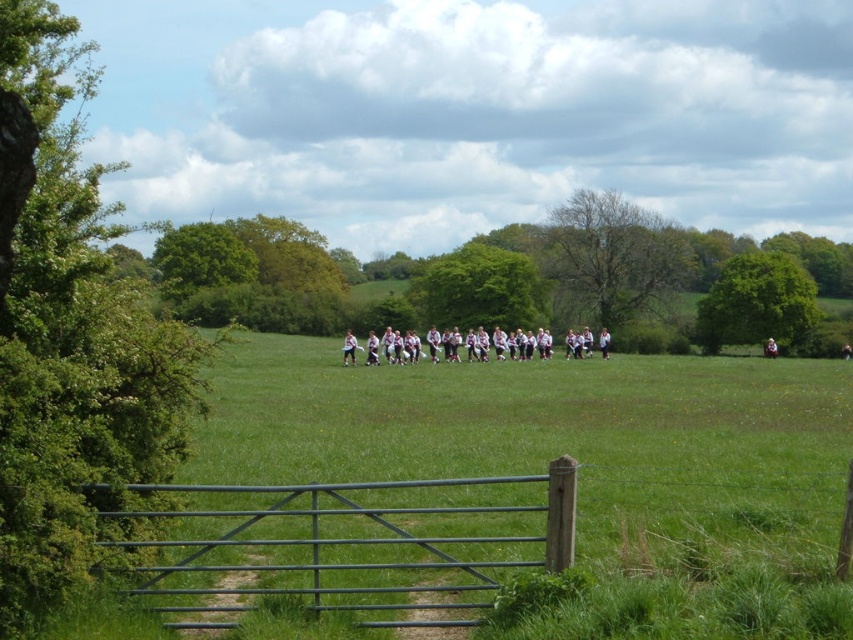
You are a photographer trying to capture a group photo of the white cotton shirt at center and the green painted metal gate at lower center. Since you want both subjects to be clearly visible in the frame, which object should you position closer to the camera to ensure it appears larger in the photo?

Answer: To ensure both the white cotton shirt at center and the green painted metal gate at lower center are clearly visible, you should position the green painted metal gate at lower center closer to the camera. Since it has a smaller size compared to the white cotton shirt at center, moving it nearer will help balance their apparent sizes in the photograph.